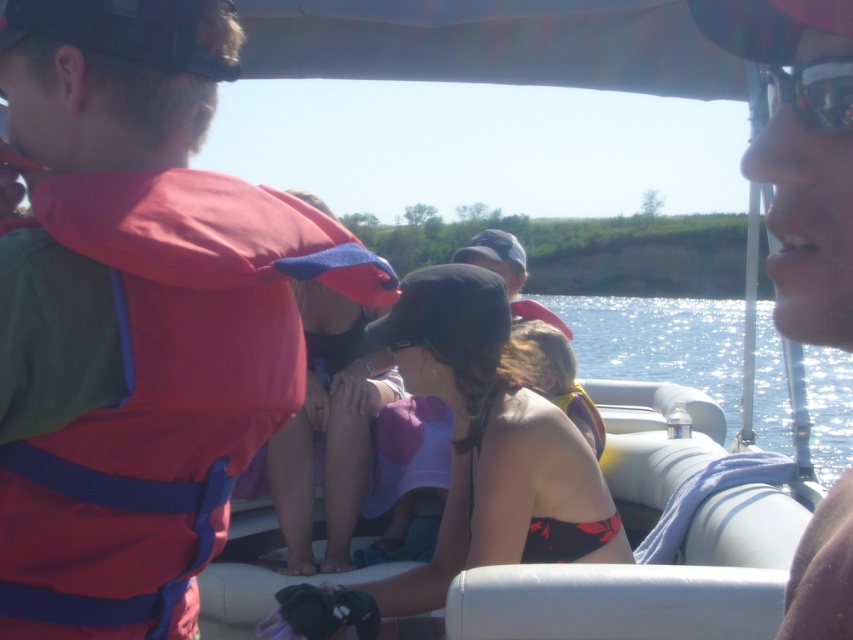
Question: Is matte black bikini top at center behind matte yellow life jacket at center?

Choices:
 (A) yes
 (B) no

Answer: (B)

Question: Which object appears closest to the camera in this image?

Choices:
 (A) matte black sunglasses at upper right
 (B) glistening water at center

Answer: (A)

Question: In this image, where is matte black sunglasses at upper right located relative to glistening water at center?

Choices:
 (A) right
 (B) left

Answer: (B)

Question: Which of the following is the closest to the observer?

Choices:
 (A) click(564, 406)
 (B) click(357, 477)
 (C) click(791, 48)

Answer: (C)

Question: Does matte red life vest at left appear under black reflective sunglasses at upper right?

Choices:
 (A) no
 (B) yes

Answer: (B)

Question: Which of the following is the closest to the observer?

Choices:
 (A) (846, 100)
 (B) (648, 371)
 (C) (564, 406)

Answer: (A)